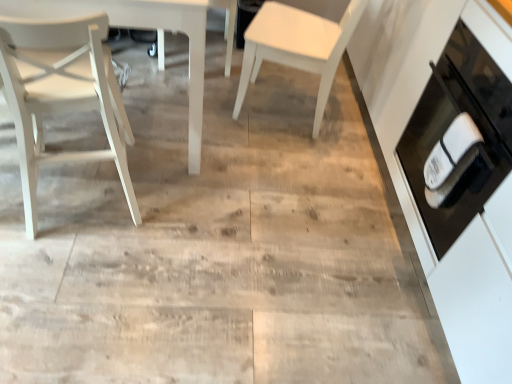
You are a GUI agent. You are given a task and a screenshot of the screen. Output one action in this format:
    pyautogui.click(x=<x>, y=<y>)
    Task: Click on the vacant space in front of white matte chair at left, which ranks as the 3th chair in right-to-left order
    
    Given the screenshot: What is the action you would take?
    tap(74, 275)